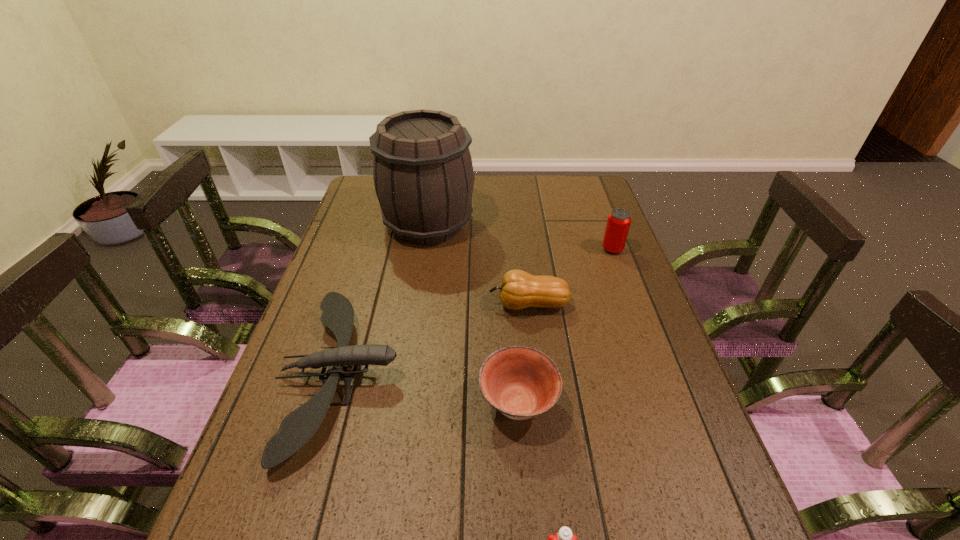
Where is `vacant space located 0.210m on the stem side of the gourd`? vacant space located 0.210m on the stem side of the gourd is located at coordinates (412, 305).

Find the location of a particular element. vacant region located 0.270m on the left of the bowl is located at coordinates (356, 403).

This screenshot has height=540, width=960. In order to click on blank area located 0.280m at the head of the drone in this screenshot , I will do `click(520, 375)`.

Image resolution: width=960 pixels, height=540 pixels. I want to click on object positioned at the far edge, so click(423, 175).

Locate an element on the screen. The width and height of the screenshot is (960, 540). wine bucket at the left edge is located at coordinates (423, 175).

Image resolution: width=960 pixels, height=540 pixels. I want to click on drone that is at the left edge, so click(299, 426).

The width and height of the screenshot is (960, 540). Identify the location of object at the right edge. tap(619, 220).

Locate an element on the screen. The image size is (960, 540). object that is at the far left corner is located at coordinates (423, 175).

I want to click on vacant space at the far edge of the desktop, so click(x=478, y=186).

In the image, there is a desktop. Find the location of `free space at the left edge`. free space at the left edge is located at coordinates (319, 296).